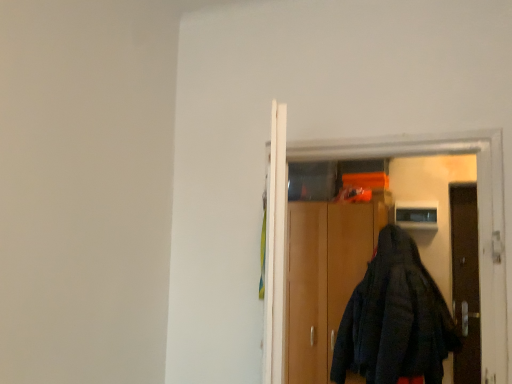
Question: From the image's perspective, relative to black fabric coat at center, is wooden cabinet at center above or below?

Choices:
 (A) below
 (B) above

Answer: (A)

Question: Is wooden cabinet at center in front of or behind black fabric coat at center in the image?

Choices:
 (A) front
 (B) behind

Answer: (B)

Question: Considering the positions of point (336, 279) and point (394, 140), is point (336, 279) closer or farther from the camera than point (394, 140)?

Choices:
 (A) farther
 (B) closer

Answer: (A)

Question: Is black fabric coat at center taller or shorter than wooden cabinet at center?

Choices:
 (A) tall
 (B) short

Answer: (B)

Question: Relative to wooden cabinet at center, is black fabric coat at center in front or behind?

Choices:
 (A) front
 (B) behind

Answer: (A)

Question: Would you say black fabric coat at center is inside or outside wooden cabinet at center?

Choices:
 (A) outside
 (B) inside

Answer: (A)

Question: From a real-world perspective, relative to wooden cabinet at center, is black fabric coat at center vertically above or below?

Choices:
 (A) below
 (B) above

Answer: (B)